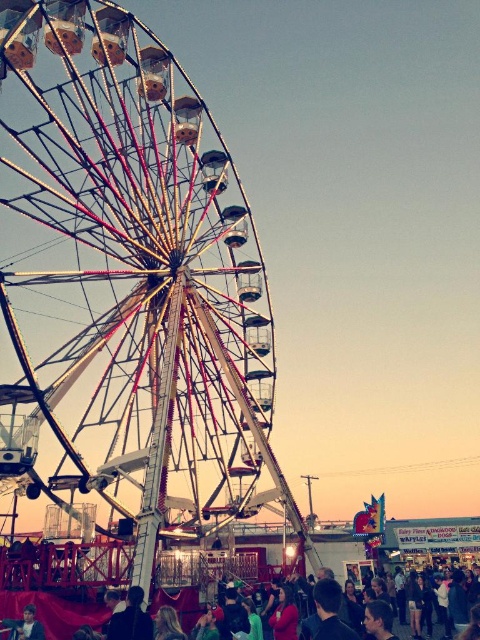
You are standing at the center of the fairground and want to locate the metallic ferris wheel at left. According to the coordinate system where the bottom left corner is the origin, can you confirm if the metallic ferris wheel at left is positioned at point (126, 285)?

Yes, the metallic ferris wheel at left is represented by point (126, 285).

You are standing at the camera position and want to reach point (6,488). Is the distance more than 100 meters?

The distance between point (6,488) and the camera is 98.64 meters, so it is less than 100 meters.